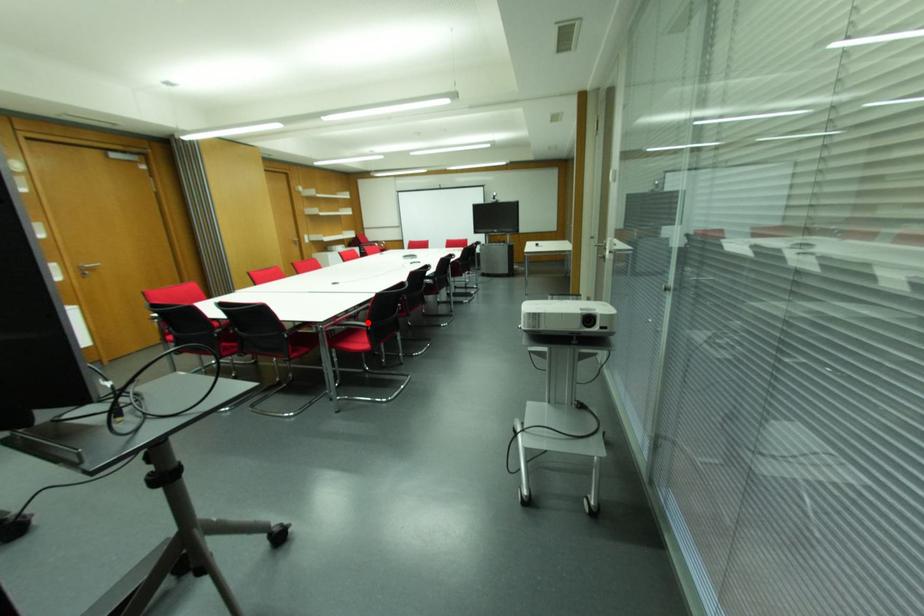
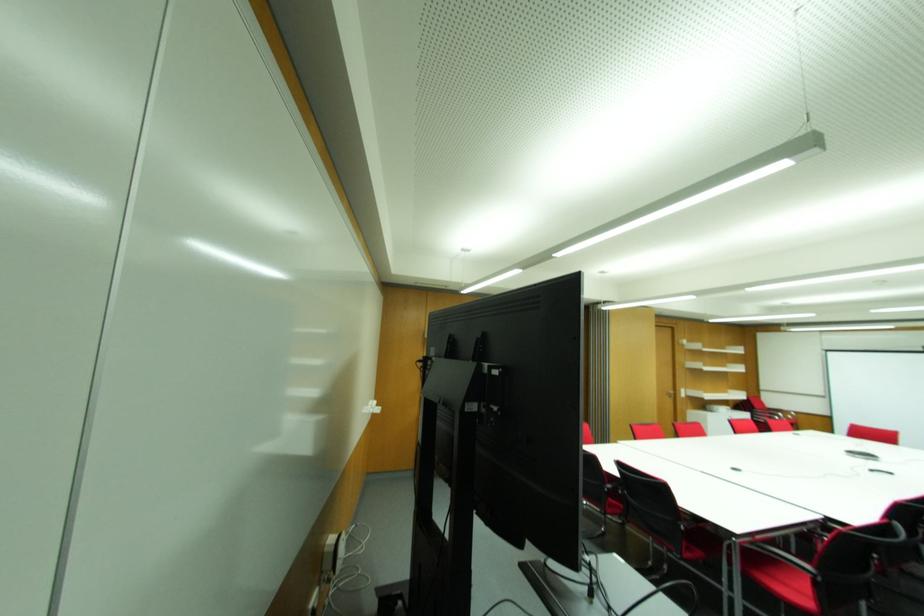
Question: I am providing you with two images of the same scene from different viewpoints. Given a red point in image1, look at the same physical point in image2. Is it:

Choices:
 (A) Closer to the viewpoint
 (B) Farther from the viewpoint

Answer: (A)